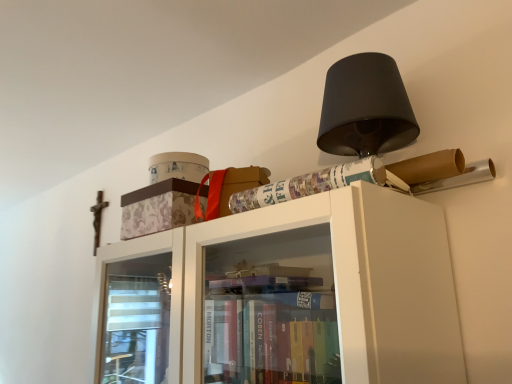
Question: Would you consider patterned paper at upper right to be distant from patterned cardboard box at upper center?

Choices:
 (A) no
 (B) yes

Answer: (A)

Question: Considering the relative positions of patterned paper at upper right and patterned cardboard box at upper center in the image provided, is patterned paper at upper right behind patterned cardboard box at upper center?

Choices:
 (A) yes
 (B) no

Answer: (B)

Question: Does patterned paper at upper right have a lesser width compared to patterned cardboard box at upper center?

Choices:
 (A) yes
 (B) no

Answer: (A)

Question: Is patterned cardboard box at upper center at the back of patterned paper at upper right?

Choices:
 (A) no
 (B) yes

Answer: (A)

Question: From the image's perspective, is patterned paper at upper right located beneath patterned cardboard box at upper center?

Choices:
 (A) no
 (B) yes

Answer: (A)

Question: Does patterned paper at upper right contain patterned cardboard box at upper center?

Choices:
 (A) yes
 (B) no

Answer: (B)

Question: Is patterned cardboard box at upper center oriented away from patterned paper at upper right?

Choices:
 (A) yes
 (B) no

Answer: (B)

Question: Considering the relative sizes of patterned cardboard box at upper center and patterned paper at upper right in the image provided, is patterned cardboard box at upper center shorter than patterned paper at upper right?

Choices:
 (A) no
 (B) yes

Answer: (A)

Question: From the image's perspective, does patterned cardboard box at upper center appear higher than patterned paper at upper right?

Choices:
 (A) yes
 (B) no

Answer: (B)

Question: Does patterned cardboard box at upper center come behind patterned paper at upper right?

Choices:
 (A) no
 (B) yes

Answer: (B)

Question: Is patterned cardboard box at upper center far from patterned paper at upper right?

Choices:
 (A) yes
 (B) no

Answer: (B)

Question: Can you confirm if patterned cardboard box at upper center is positioned to the left of patterned paper at upper right?

Choices:
 (A) no
 (B) yes

Answer: (B)

Question: From the image's perspective, relative to patterned paper at upper right, is patterned cardboard box at upper center above or below?

Choices:
 (A) above
 (B) below

Answer: (B)